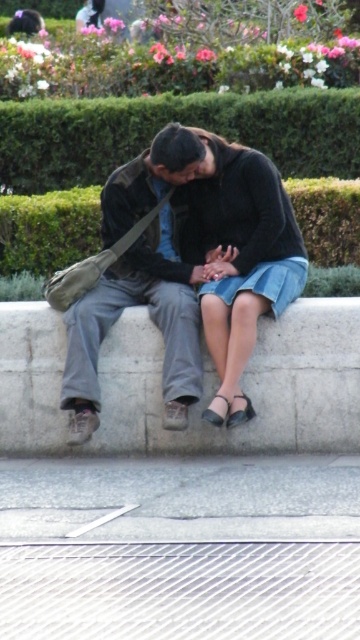
Between matte black jacket at center and green leafy hedge at upper center, which one is positioned higher?

green leafy hedge at upper center is higher up.

Is matte black jacket at center wider than green leafy hedge at upper center?

No, matte black jacket at center is not wider than green leafy hedge at upper center.

Does point (79, 380) lie in front of point (291, 90)?

That is True.

The image size is (360, 640). Find the location of `matte black jacket at center`. matte black jacket at center is located at coordinates (189, 269).

Does white concrete at center appear on the left side of green leafy hedge at center?

No, white concrete at center is not to the left of green leafy hedge at center.

Locate an element on the screen. The height and width of the screenshot is (640, 360). white concrete at center is located at coordinates (243, 387).

Does point (136, 403) lie behind point (312, 228)?

That is False.

Locate an element on the screen. white concrete at center is located at coordinates (243, 387).

Measure the distance between matte black jacket at center and camera.

The distance of matte black jacket at center from camera is 7.81 meters.

Which is below, matte black jacket at center or white concrete at center?

white concrete at center

Who is more distant from viewer, [105,205] or [347,387]?

The point [105,205] is more distant.

The height and width of the screenshot is (640, 360). In order to click on matte black jacket at center in this screenshot , I will do `click(189, 269)`.